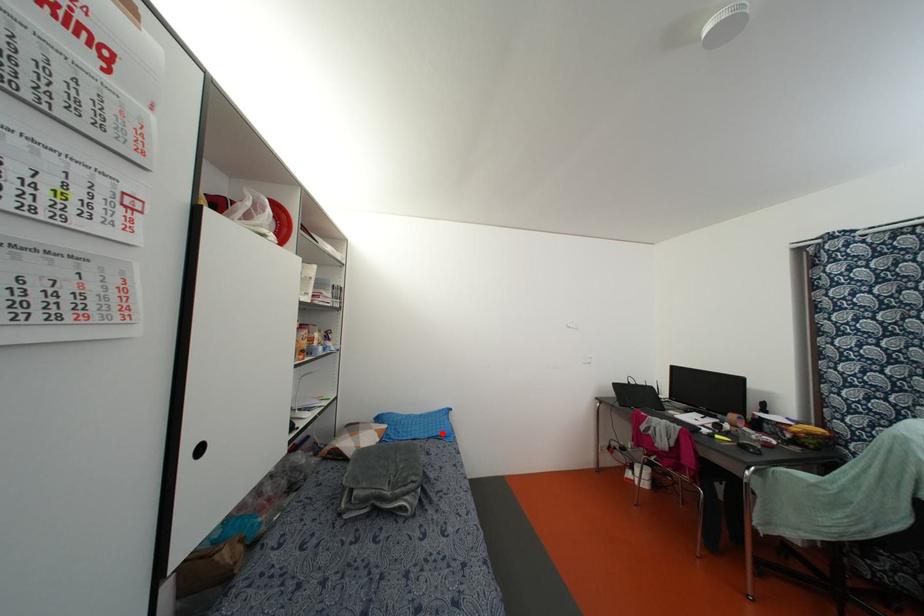
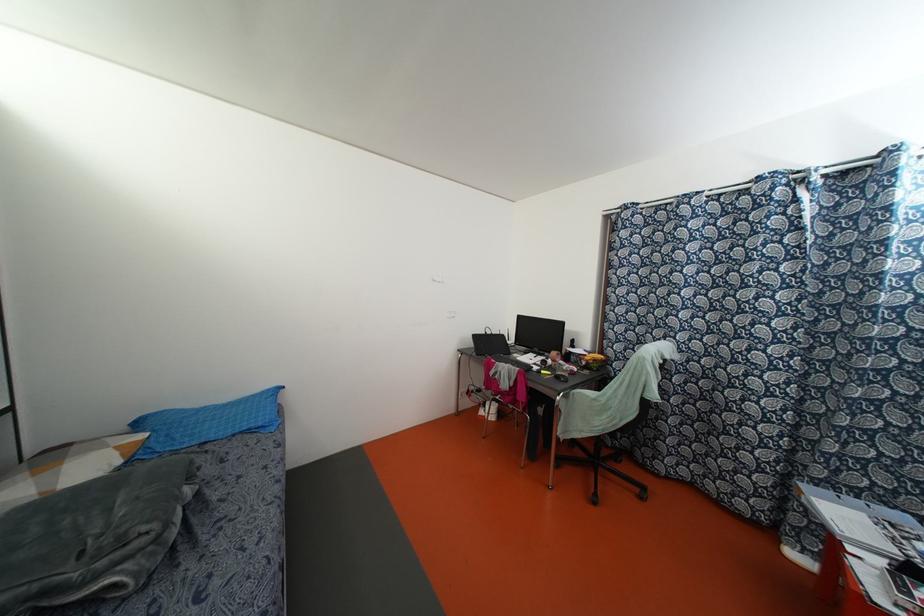
Question: I am providing you with two images of the same scene from different viewpoints. A red point is shown in image1. For the corresponding object point in image2, is it positioned nearer or farther from the camera?

Choices:
 (A) Nearer
 (B) Farther

Answer: (A)